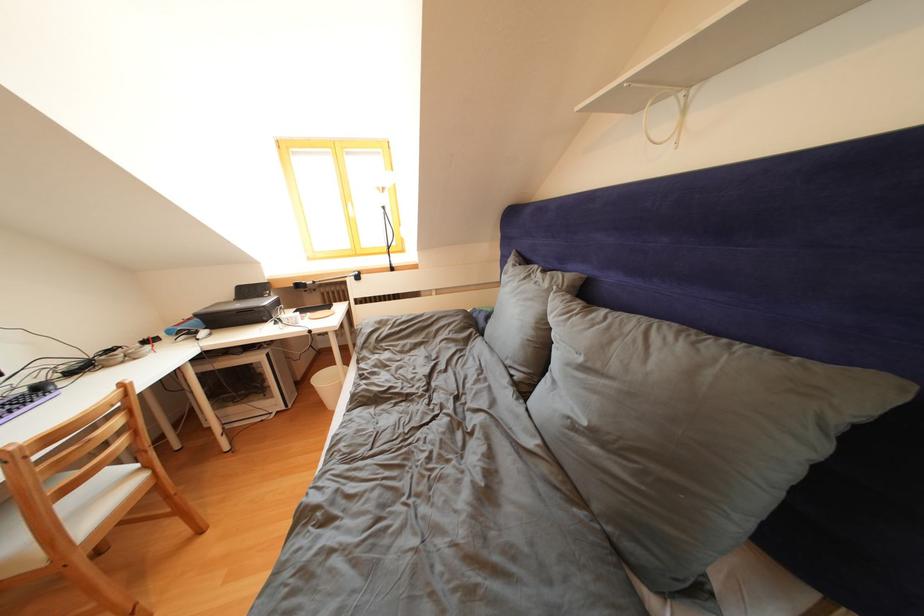
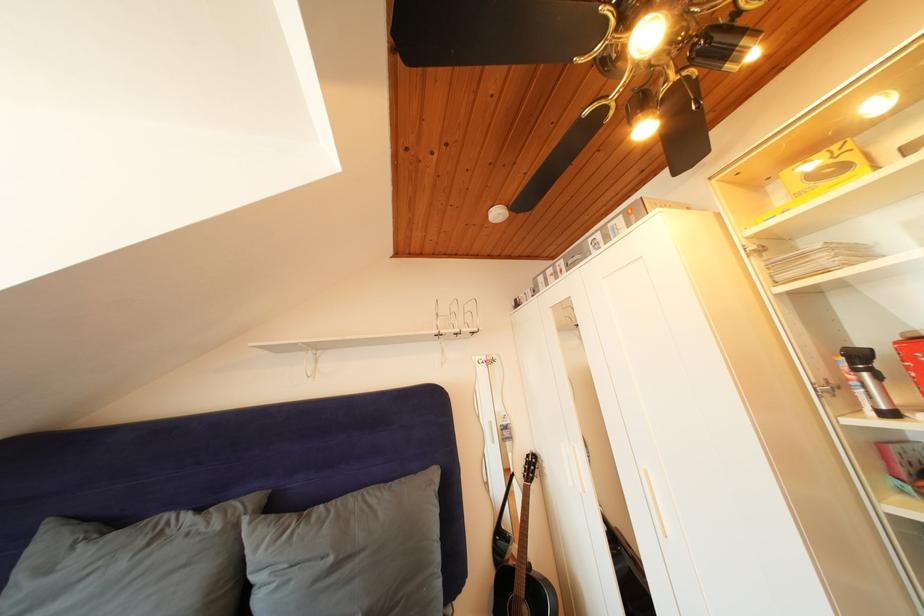
Find the pixel in the second image that matches point (590, 363) in the first image.

(338, 565)